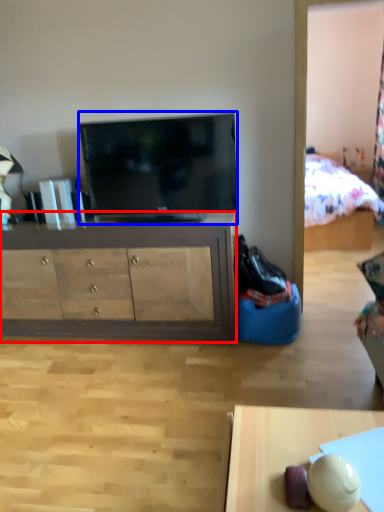
Question: Which point is further to the camera, cabinetry (highlighted by a red box) or television (highlighted by a blue box)?

Choices:
 (A) cabinetry
 (B) television

Answer: (A)